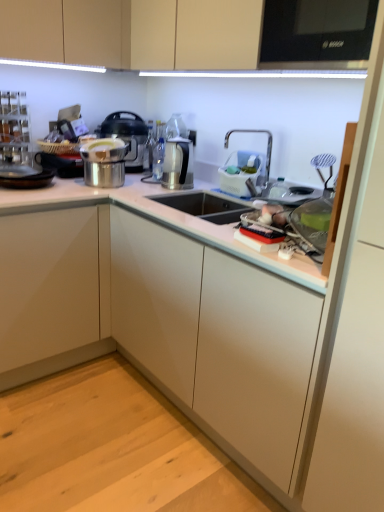
Question: From the image's perspective, is stainless steel pot at center below satin silver kettle at center, the first appliance positioned from the left?

Choices:
 (A) yes
 (B) no

Answer: (B)

Question: Is stainless steel pot at center at the right side of satin silver kettle at center, the first appliance positioned from the left?

Choices:
 (A) yes
 (B) no

Answer: (B)

Question: Is stainless steel pot at center positioned in front of satin silver kettle at center, the 2th appliance positioned from the right?

Choices:
 (A) no
 (B) yes

Answer: (A)

Question: Is there a large distance between stainless steel pot at center and satin silver kettle at center, the 2th appliance positioned from the right?

Choices:
 (A) yes
 (B) no

Answer: (B)

Question: Considering the relative sizes of stainless steel pot at center and satin silver kettle at center, the first appliance positioned from the left, in the image provided, is stainless steel pot at center bigger than satin silver kettle at center, the first appliance positioned from the left,?

Choices:
 (A) no
 (B) yes

Answer: (B)

Question: Is matte beige cabinets at upper center, the 1th cabinetry from the top, wider or thinner than white plastic sink at upper right?

Choices:
 (A) thin
 (B) wide

Answer: (B)

Question: From the image's perspective, relative to white plastic sink at upper right, is matte beige cabinets at upper center, which is counted as the 2th cabinetry, starting from the bottom, above or below?

Choices:
 (A) above
 (B) below

Answer: (A)

Question: From a real-world perspective, is matte beige cabinets at upper center, which ranks as the first cabinetry in right-to-left order, positioned above or below white plastic sink at upper right?

Choices:
 (A) below
 (B) above

Answer: (B)

Question: From their relative heights in the image, would you say matte beige cabinets at upper center, which ranks as the first cabinetry in right-to-left order, is taller or shorter than white plastic sink at upper right?

Choices:
 (A) short
 (B) tall

Answer: (B)

Question: Do you think white plastic dish rack at upper right, acting as the 1th appliance starting from the right, is within white plastic sink at upper right, or outside of it?

Choices:
 (A) outside
 (B) inside

Answer: (A)

Question: From a real-world perspective, is white plastic dish rack at upper right, which ranks as the 2th appliance in left-to-right order, above or below white plastic sink at upper right?

Choices:
 (A) above
 (B) below

Answer: (B)

Question: Is point (236, 154) closer or farther from the camera than point (286, 196)?

Choices:
 (A) farther
 (B) closer

Answer: (A)

Question: Is white plastic dish rack at upper right, which ranks as the 2th appliance in left-to-right order, taller or shorter than white plastic sink at upper right?

Choices:
 (A) tall
 (B) short

Answer: (B)

Question: Is point (266, 176) closer or farther from the camera than point (249, 156)?

Choices:
 (A) closer
 (B) farther

Answer: (A)

Question: Looking at their shapes, would you say white plastic sink at upper right is wider or thinner than white plastic dish rack at upper right, acting as the 1th appliance starting from the right?

Choices:
 (A) thin
 (B) wide

Answer: (B)